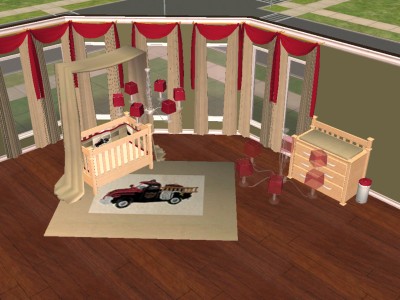
I want to click on dollhouse, so click(274, 220).